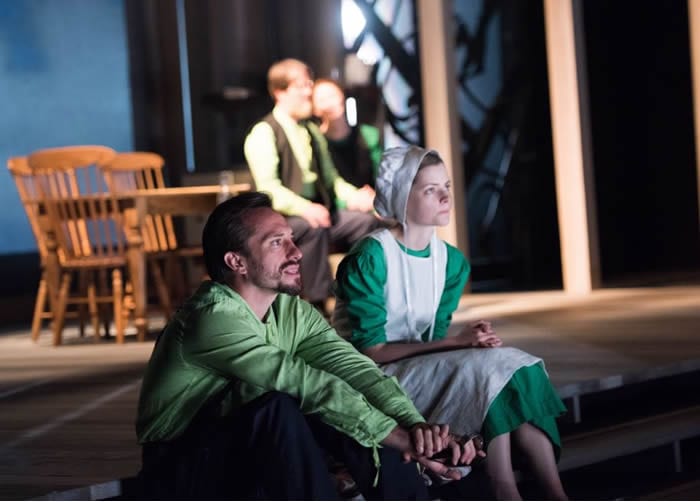
Locate an element on the screen. The image size is (700, 502). wooden table is located at coordinates (182, 192).